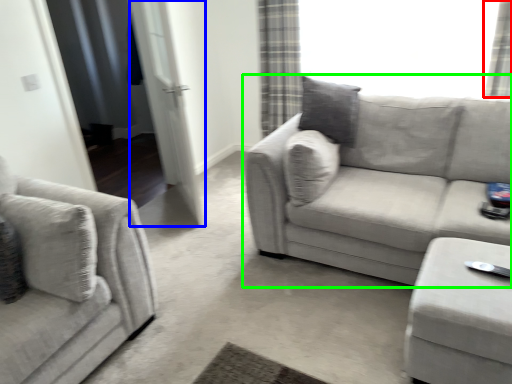
Question: Considering the real-world distances, which object is closest to curtain (highlighted by a red box)? screen door (highlighted by a blue box) or studio couch (highlighted by a green box).

Choices:
 (A) screen door
 (B) studio couch

Answer: (B)